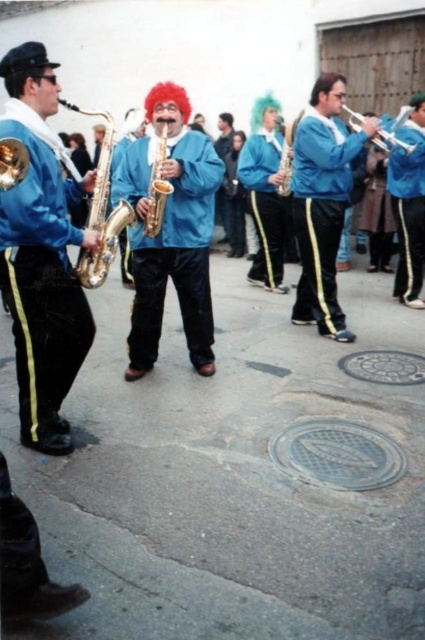
Question: Among these objects, which one is farthest from the camera?

Choices:
 (A) silver metallic trumpet at center
 (B) dark brown hair at upper center
 (C) matte blue jacket at center

Answer: (A)

Question: Estimate the real-world distances between objects in this image. Which object is closer to the blue velvety jacket at right?

Choices:
 (A) shiny brass trumpet at right
 (B) blue velvety pants at center

Answer: (A)

Question: Can you confirm if blue velvety jacket at center is thinner than gold shiny trumpet at center?

Choices:
 (A) no
 (B) yes

Answer: (A)

Question: Where is gold shiny trumpet at center located in relation to blue fabric saxophone at center in the image?

Choices:
 (A) above
 (B) below

Answer: (B)

Question: Which object is the farthest from the blue velvety jacket at right?

Choices:
 (A) blue velvety pants at center
 (B) matte blue jacket at center

Answer: (B)

Question: Can you confirm if blue velvety pants at center is wider than dark brown hair at upper center?

Choices:
 (A) no
 (B) yes

Answer: (B)